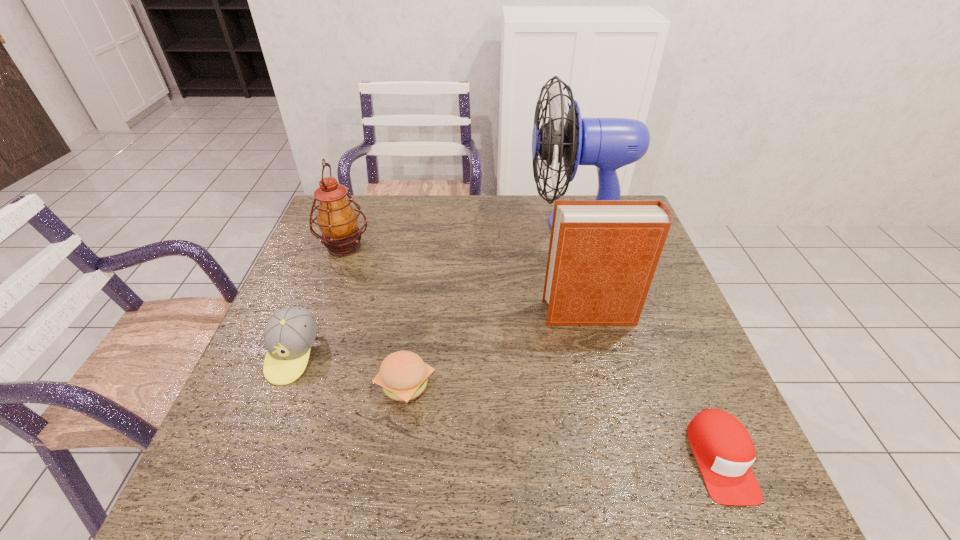
This screenshot has height=540, width=960. I want to click on vacant point located between the tallest object and the hamburger, so click(x=492, y=304).

You are a GUI agent. You are given a task and a screenshot of the screen. Output one action in this format:
    pyautogui.click(x=<x>, y=<y>)
    Task: Click on the closest object relative to the third shortest object
    Image resolution: width=960 pixels, height=540 pixels.
    Given the screenshot: What is the action you would take?
    pyautogui.click(x=403, y=376)

Locate which object is the fifth closest to the nearest object. Please provide its 2D coordinates. Your answer should be formatted as a tuple, i.e. [(x, y)], where the tuple contains the x and y coordinates of a point satisfying the conditions above.

[(337, 220)]

Where is `vacant space that satisfies the following two spatial constraints: 1. in front of the fan where the airflow is directed; 2. on the front-facing side of the fourth tallest object`? vacant space that satisfies the following two spatial constraints: 1. in front of the fan where the airflow is directed; 2. on the front-facing side of the fourth tallest object is located at coordinates (614, 354).

At what (x,y) coordinates should I click in order to perform the action: click on free space that satisfies the following two spatial constraints: 1. on the front-facing side of the farther baseball cap; 2. on the right side of the third object from left to right. Please return your answer as a coordinate pair (x, y). Looking at the image, I should click on (280, 384).

Identify the location of free space that satisfies the following two spatial constraints: 1. on the front-facing side of the hamburger; 2. on the right side of the farther baseball cap. (280, 384).

Where is `free space that satisfies the following two spatial constraints: 1. on the open cover of the hardback book; 2. on the front-facing side of the farther baseball cap`? Image resolution: width=960 pixels, height=540 pixels. free space that satisfies the following two spatial constraints: 1. on the open cover of the hardback book; 2. on the front-facing side of the farther baseball cap is located at coordinates (600, 354).

Where is `free space in the image that satisfies the following two spatial constraints: 1. on the open cover of the hardback book; 2. on the front-facing side of the taller baseball cap`? The width and height of the screenshot is (960, 540). free space in the image that satisfies the following two spatial constraints: 1. on the open cover of the hardback book; 2. on the front-facing side of the taller baseball cap is located at coordinates (600, 354).